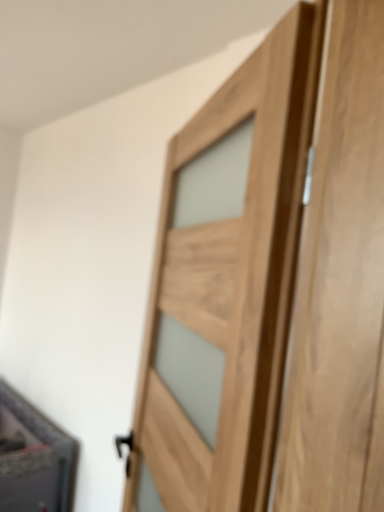
Question: From the image's perspective, is natural wood door at center beneath matte black cabinet at lower left?

Choices:
 (A) yes
 (B) no

Answer: (B)

Question: Is natural wood door at center thinner than matte black cabinet at lower left?

Choices:
 (A) yes
 (B) no

Answer: (A)

Question: Is natural wood door at center oriented towards matte black cabinet at lower left?

Choices:
 (A) yes
 (B) no

Answer: (B)

Question: Is matte black cabinet at lower left surrounded by natural wood door at center?

Choices:
 (A) no
 (B) yes

Answer: (A)

Question: Can you confirm if natural wood door at center is positioned to the right of matte black cabinet at lower left?

Choices:
 (A) no
 (B) yes

Answer: (B)

Question: Is natural wood door at center oriented away from matte black cabinet at lower left?

Choices:
 (A) yes
 (B) no

Answer: (B)

Question: From the image's perspective, is matte black cabinet at lower left on natural wood door at center?

Choices:
 (A) no
 (B) yes

Answer: (A)

Question: Is matte black cabinet at lower left looking in the opposite direction of natural wood door at center?

Choices:
 (A) yes
 (B) no

Answer: (B)

Question: Is matte black cabinet at lower left aimed at natural wood door at center?

Choices:
 (A) no
 (B) yes

Answer: (A)

Question: From a real-world perspective, is matte black cabinet at lower left located higher than natural wood door at center?

Choices:
 (A) yes
 (B) no

Answer: (B)

Question: Can you confirm if matte black cabinet at lower left is taller than natural wood door at center?

Choices:
 (A) yes
 (B) no

Answer: (B)

Question: Considering the relative sizes of matte black cabinet at lower left and natural wood door at center in the image provided, is matte black cabinet at lower left wider than natural wood door at center?

Choices:
 (A) yes
 (B) no

Answer: (A)

Question: From the image's perspective, is natural wood door at center positioned above or below matte black cabinet at lower left?

Choices:
 (A) below
 (B) above

Answer: (B)